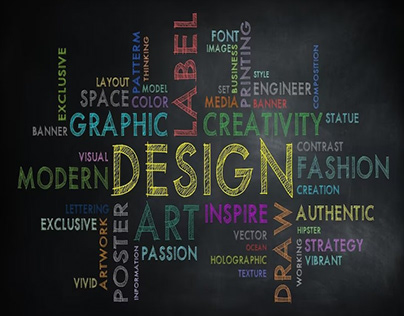
The width and height of the screenshot is (404, 316). In order to click on art in this screenshot , I will do `click(174, 233)`.